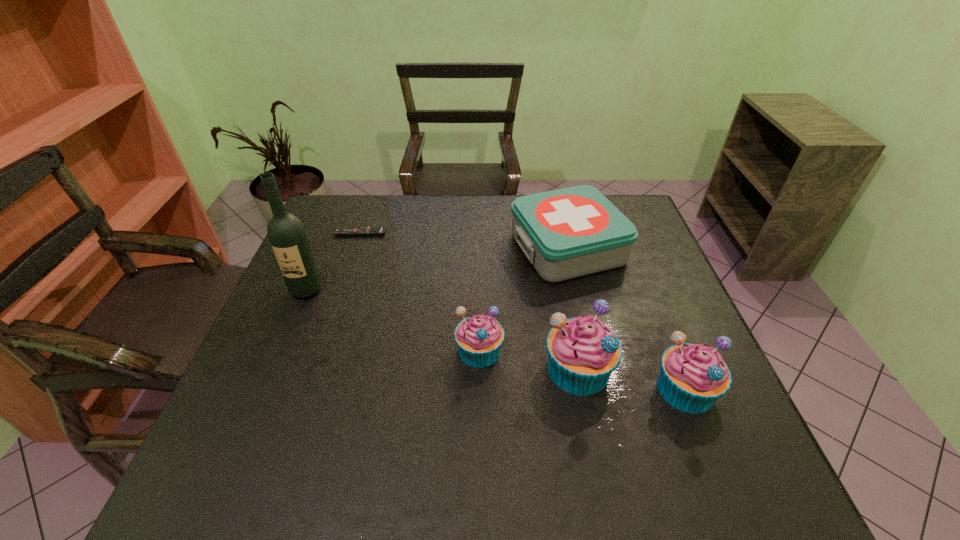
At what (x,y) coordinates should I click in order to perform the action: click on blank space located on the left of the third tallest object. Please return your answer as a coordinate pair (x, y). The image size is (960, 540). Looking at the image, I should click on (599, 389).

Image resolution: width=960 pixels, height=540 pixels. In order to click on vacant space located 0.140m on the front of the first-aid kit in this screenshot , I will do `click(586, 326)`.

Identify the location of blank area located 0.190m on the front of the shortest object. (346, 278).

Image resolution: width=960 pixels, height=540 pixels. I want to click on vacant space located 0.260m on the labeled side of the wine bottle, so click(266, 385).

At what (x,y) coordinates should I click in order to perform the action: click on the first-aid kit that is at the far edge. Please return your answer as a coordinate pair (x, y). Image resolution: width=960 pixels, height=540 pixels. Looking at the image, I should click on (576, 231).

Find the location of a particular element. remote control at the far edge is located at coordinates (378, 230).

Where is `object present at the near edge`? object present at the near edge is located at coordinates (693, 376).

You are a GUI agent. You are given a task and a screenshot of the screen. Output one action in this format:
    pyautogui.click(x=<x>, y=<y>)
    Task: Click on the remote control that is positioned at the left edge
    The width and height of the screenshot is (960, 540).
    Given the screenshot: What is the action you would take?
    pyautogui.click(x=378, y=230)

This screenshot has height=540, width=960. What are the coordinates of `wine bottle that is at the left edge` in the screenshot? It's located at (287, 236).

Where is `muffin that is at the right edge`? This screenshot has width=960, height=540. muffin that is at the right edge is located at coordinates (693, 376).